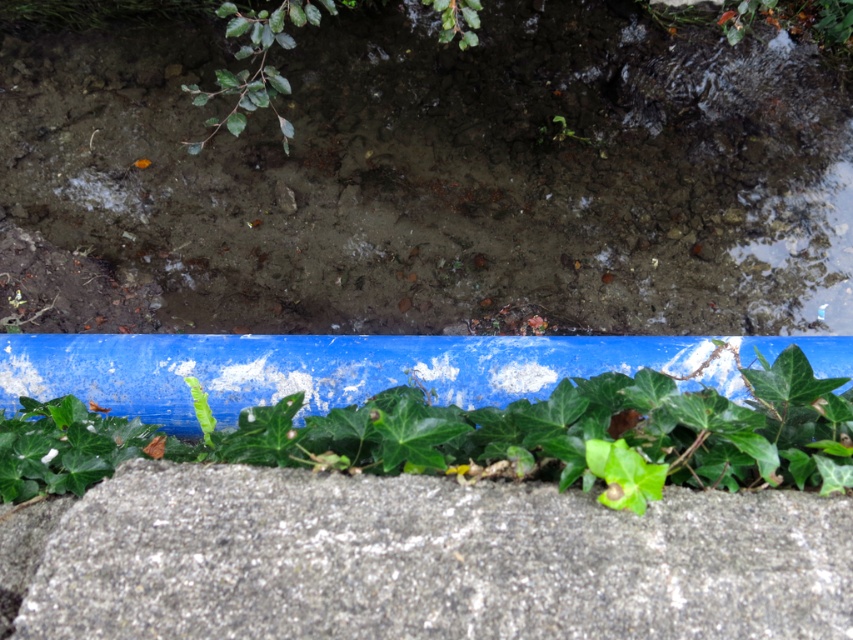
Looking at this image, which of these two, translucent mud puddle at upper center or gray rough concrete at bottom, stands taller?

translucent mud puddle at upper center

Measure the distance between point (785,268) and camera.

3.09 meters

Who is more forward, (827, 208) or (210, 586)?

Point (210, 586) is in front.

I want to click on translucent mud puddle at upper center, so click(431, 179).

From the picture: Does translucent mud puddle at upper center have a lesser width compared to green leafy plant at bottom?

Incorrect, translucent mud puddle at upper center's width is not less than green leafy plant at bottom's.

Does point (595, 198) come farther from viewer compared to point (363, 438)?

That is True.

Locate an element on the screen. translucent mud puddle at upper center is located at coordinates (431, 179).

Does gray rough concrete at bottom have a greater width compared to green leafy plant at bottom?

No, gray rough concrete at bottom is not wider than green leafy plant at bottom.

Which of these two, gray rough concrete at bottom or green leafy plant at bottom, stands shorter?

gray rough concrete at bottom

Who is more distant from viewer, (463, 497) or (242, 412)?

The point (242, 412) is behind.

Where is `gray rough concrete at bottom`? This screenshot has height=640, width=853. gray rough concrete at bottom is located at coordinates (419, 560).